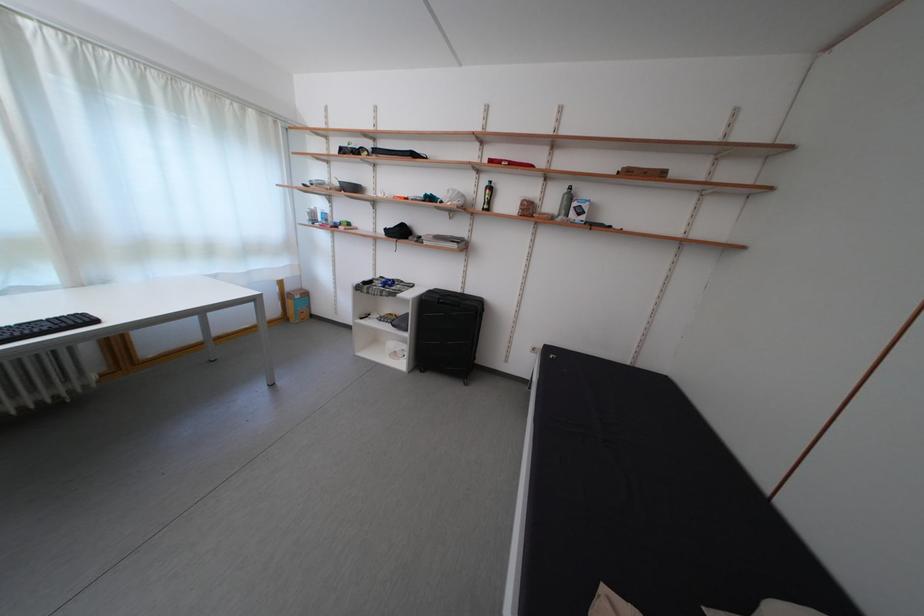
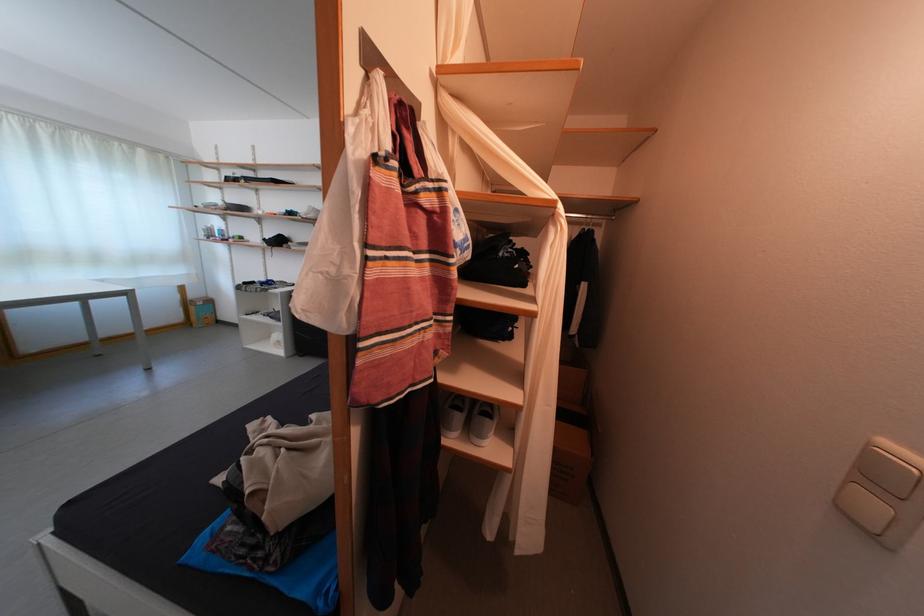
What movement of the cameraman would produce the second image?

The movement direction of the cameraman is right, backward.